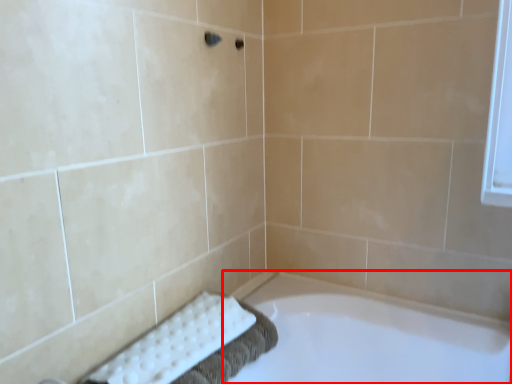
Question: From the image's perspective, where is bathtub (annotated by the red box) located in relation to bath towel in the image?

Choices:
 (A) above
 (B) below

Answer: (B)